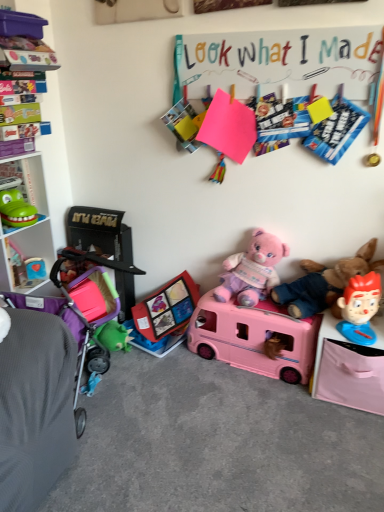
Question: Does pink plastic toy bus at center, marked as the first toy in a bottom-to-top arrangement, lie behind smooth red plastic toy at right, which appears as the 2th toy when ordered from the bottom?

Choices:
 (A) yes
 (B) no

Answer: (A)

Question: Is pink plastic toy bus at center, marked as the first toy in a bottom-to-top arrangement, taller than smooth red plastic toy at right, the third toy in the top-to-bottom sequence?

Choices:
 (A) no
 (B) yes

Answer: (B)

Question: Can you confirm if pink plastic toy bus at center, the fourth toy positioned from the top, is wider than smooth red plastic toy at right, the first toy in the right-to-left sequence?

Choices:
 (A) no
 (B) yes

Answer: (B)

Question: Is pink plastic toy bus at center, placed as the 3th toy when sorted from left to right, far from smooth red plastic toy at right, which is the fourth toy from left to right?

Choices:
 (A) no
 (B) yes

Answer: (A)

Question: Considering the relative positions of pink plastic toy bus at center, the second toy from the right, and smooth red plastic toy at right, which is the fourth toy from left to right, in the image provided, is pink plastic toy bus at center, the second toy from the right, to the left of smooth red plastic toy at right, which is the fourth toy from left to right, from the viewer's perspective?

Choices:
 (A) yes
 (B) no

Answer: (A)

Question: In terms of height, does white plastic cabinet at left look taller or shorter compared to colored paperboard at upper center?

Choices:
 (A) tall
 (B) short

Answer: (A)

Question: Considering the positions of point (39, 159) and point (193, 133), is point (39, 159) closer or farther from the camera than point (193, 133)?

Choices:
 (A) closer
 (B) farther

Answer: (B)

Question: From the image's perspective, is white plastic cabinet at left located above or below colored paperboard at upper center?

Choices:
 (A) above
 (B) below

Answer: (B)

Question: In terms of width, does white plastic cabinet at left look wider or thinner when compared to colored paperboard at upper center?

Choices:
 (A) thin
 (B) wide

Answer: (B)

Question: Choose the correct answer: Is soft pink plush at right, the 1th teddy bear when ordered from right to left, inside green rubbery toy at left, arranged as the 4th toy when viewed from the right, or outside it?

Choices:
 (A) outside
 (B) inside

Answer: (A)

Question: In terms of width, does soft pink plush at right, positioned as the second teddy bear in left-to-right order, look wider or thinner when compared to green rubbery toy at left, the first toy when ordered from left to right?

Choices:
 (A) thin
 (B) wide

Answer: (B)

Question: Visually, is soft pink plush at right, positioned as the second teddy bear in left-to-right order, positioned to the left or to the right of green rubbery toy at left, the first toy when ordered from left to right?

Choices:
 (A) left
 (B) right

Answer: (B)

Question: From the image's perspective, is soft pink plush at right, positioned as the second teddy bear in left-to-right order, positioned above or below green rubbery toy at left, the first toy when ordered from left to right?

Choices:
 (A) above
 (B) below

Answer: (B)

Question: Is smooth red plastic toy at right, which is the fourth toy from left to right, spatially inside purple fabric baby carriage at left, or outside of it?

Choices:
 (A) inside
 (B) outside

Answer: (B)

Question: Is point (370, 311) positioned closer to the camera than point (105, 312)?

Choices:
 (A) closer
 (B) farther

Answer: (A)